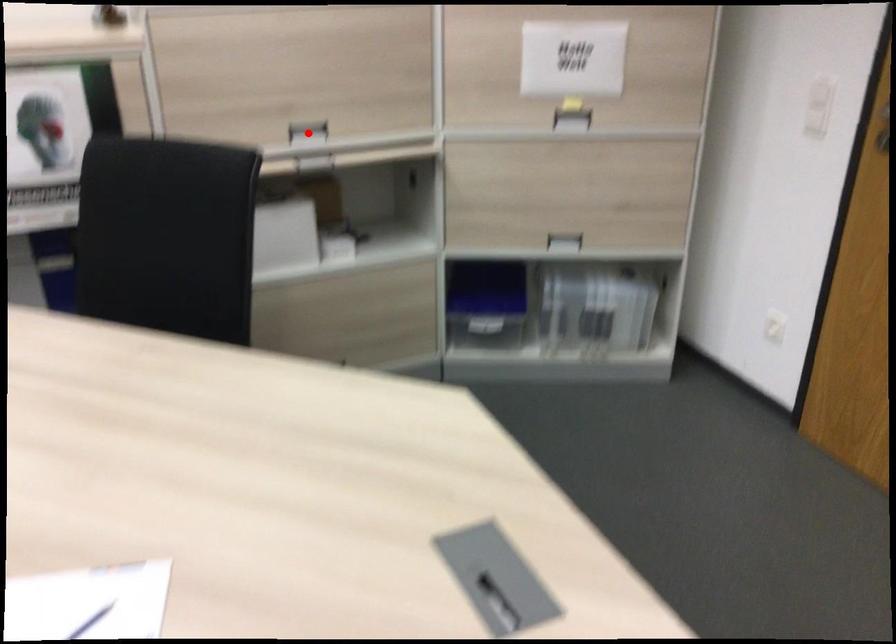
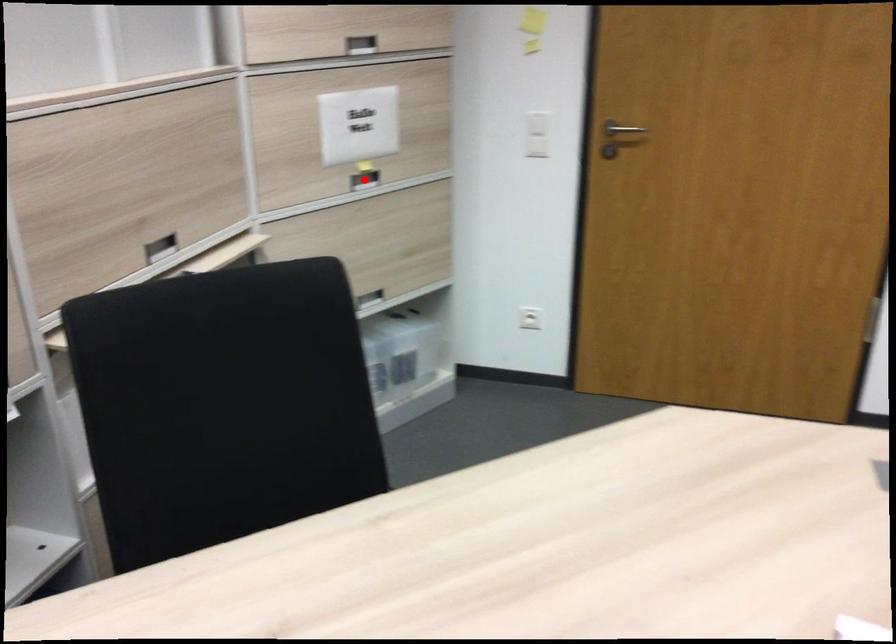
I am providing you with two images of the same scene from different viewpoints. A red point is marked on the first image and another point is marked on the second image. Is the marked point in image1 the same physical position as the marked point in image2?

No